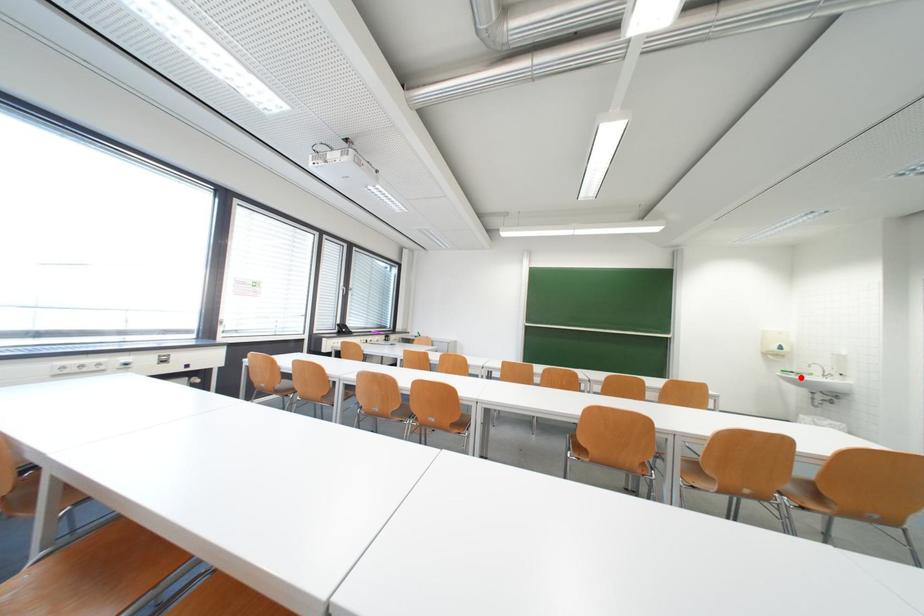
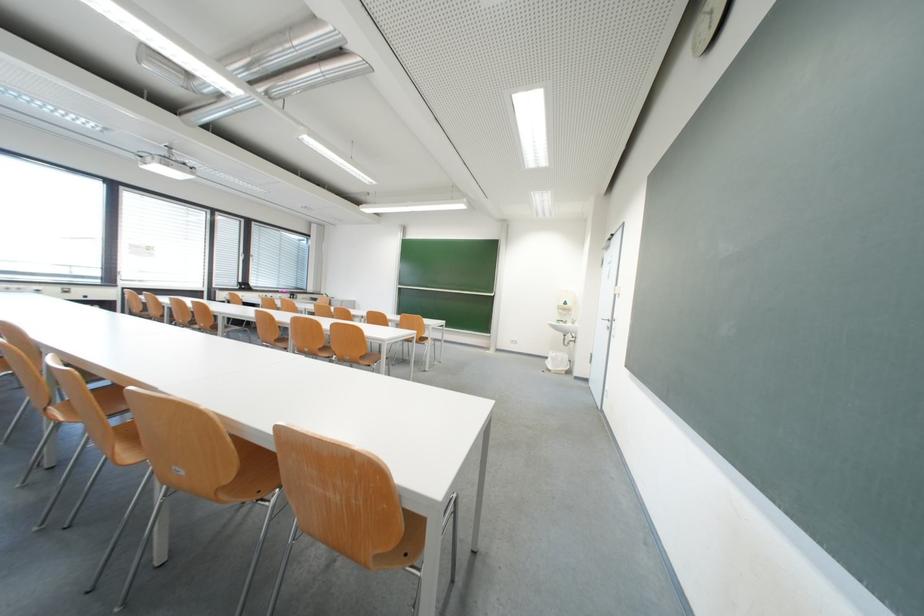
Question: I am providing you with two images of the same scene from different viewpoints. Given a red point in image1, look at the same physical point in image2. Is it:

Choices:
 (A) Closer to the viewpoint
 (B) Farther from the viewpoint

Answer: (A)